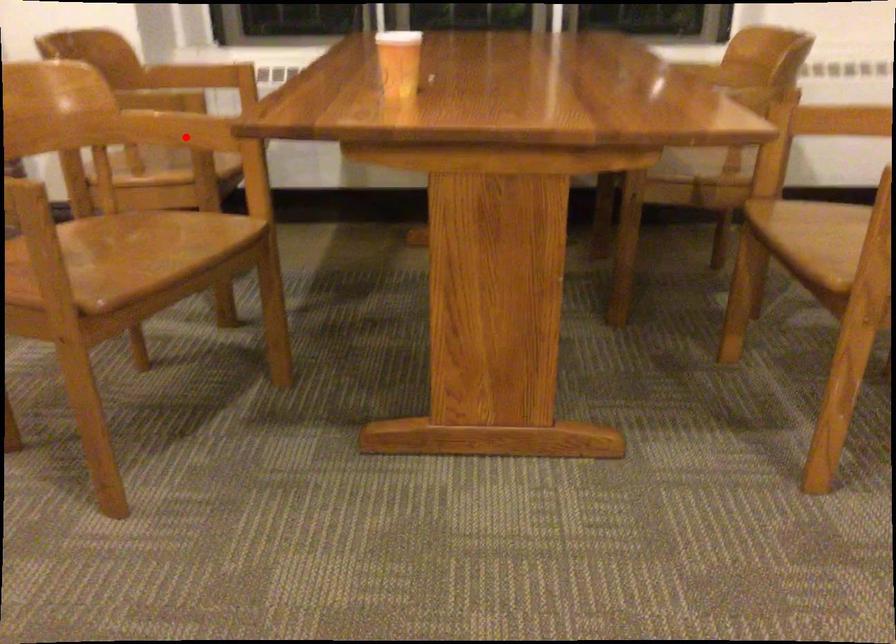
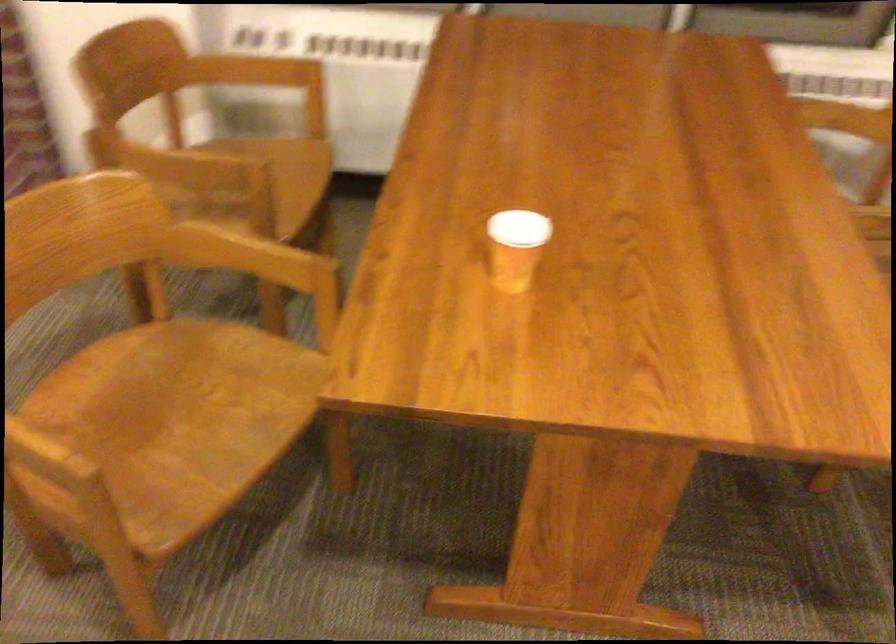
Question: A red point is marked in image1. In image2, is the corresponding 3D point closer to the camera or farther? Reply with the corresponding letter.

Choices:
 (A) The corresponding 3D point is closer.
 (B) The corresponding 3D point is farther.

Answer: (A)